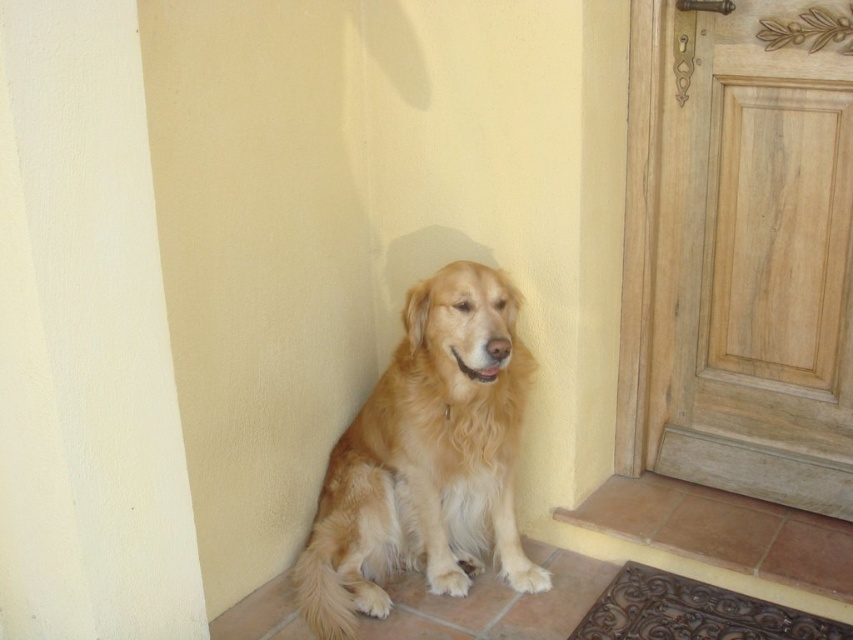
Question: Which point is closer to the camera taking this photo?

Choices:
 (A) (405, 337)
 (B) (756, 456)

Answer: (A)

Question: Which point is closer to the camera taking this photo?

Choices:
 (A) [720, 355]
 (B) [341, 492]

Answer: (B)

Question: Is light brown wood door at right above golden fur dog at center?

Choices:
 (A) no
 (B) yes

Answer: (B)

Question: Is light brown wood door at right bigger than golden fur dog at center?

Choices:
 (A) no
 (B) yes

Answer: (B)

Question: Is light brown wood door at right positioned behind golden fur dog at center?

Choices:
 (A) yes
 (B) no

Answer: (A)